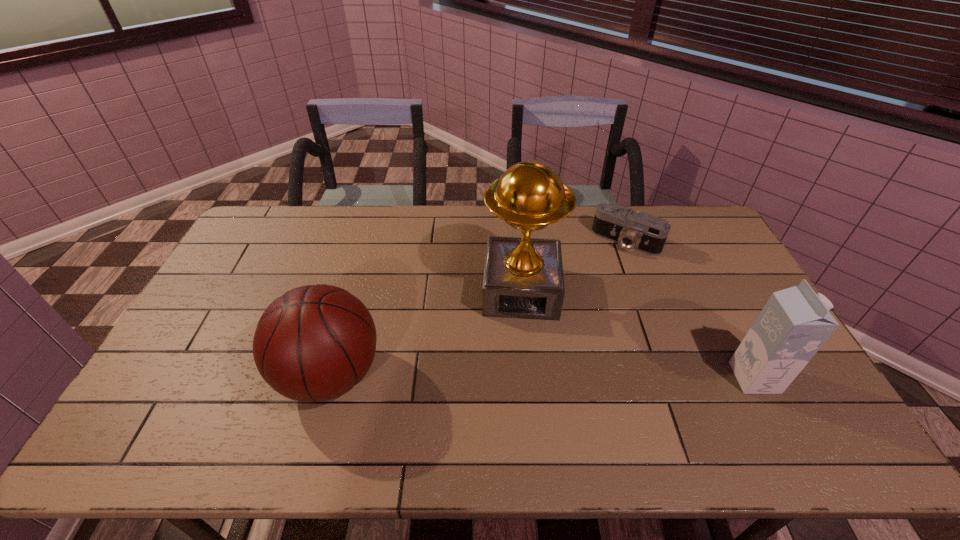
Identify the location of basketball. (314, 343).

You are a GUI agent. You are given a task and a screenshot of the screen. Output one action in this format:
    pyautogui.click(x=<x>, y=<y>)
    Task: Click on the carton
    The height and width of the screenshot is (540, 960).
    Given the screenshot: What is the action you would take?
    pyautogui.click(x=794, y=324)

You are a GUI agent. You are given a task and a screenshot of the screen. Output one action in this format:
    pyautogui.click(x=<x>, y=<y>)
    Task: Click on the third nearest object
    The width and height of the screenshot is (960, 540).
    Given the screenshot: What is the action you would take?
    pyautogui.click(x=523, y=278)

Find the location of `the tallest object`. the tallest object is located at coordinates (523, 278).

Identify the location of the second object from right to left. The image size is (960, 540). (630, 229).

Find the location of a particular element. Image resolution: width=960 pixels, height=540 pixels. camera is located at coordinates (630, 229).

Where is `free space located 0.110m on the back of the basketball`? free space located 0.110m on the back of the basketball is located at coordinates (350, 305).

Find the location of a particular element. This screenshot has height=540, width=960. free region located 0.230m on the front-facing side of the third object from right to left is located at coordinates (520, 388).

Image resolution: width=960 pixels, height=540 pixels. I want to click on free space located on the front-facing side of the third object from right to left, so click(519, 413).

You are a GUI agent. You are given a task and a screenshot of the screen. Output one action in this format:
    pyautogui.click(x=<x>, y=<y>)
    Task: Click on the free location located on the front-facing side of the third object from right to left
    Image resolution: width=960 pixels, height=540 pixels.
    Given the screenshot: What is the action you would take?
    pyautogui.click(x=520, y=362)